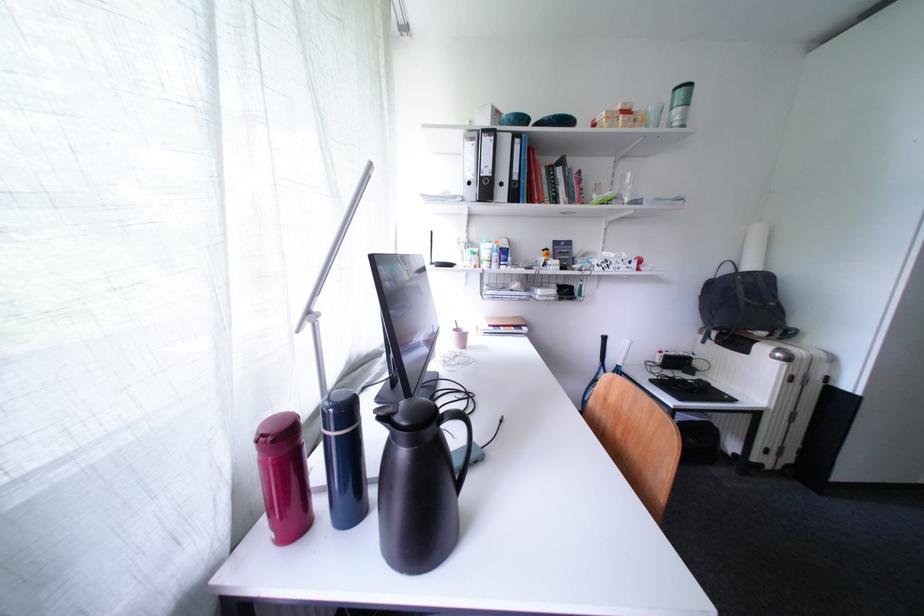
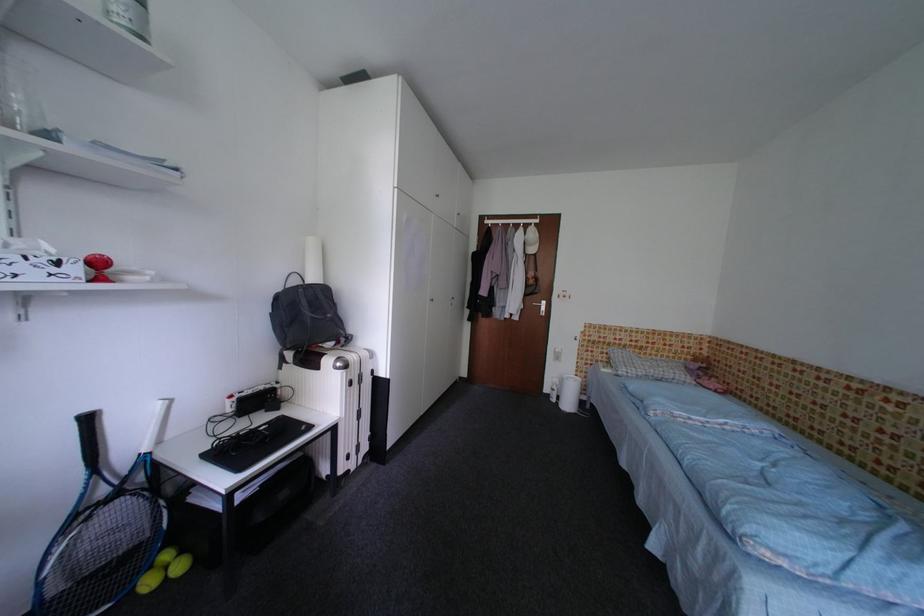
In the second image, find the point that corresponds to (x=718, y=286) in the first image.

(286, 301)